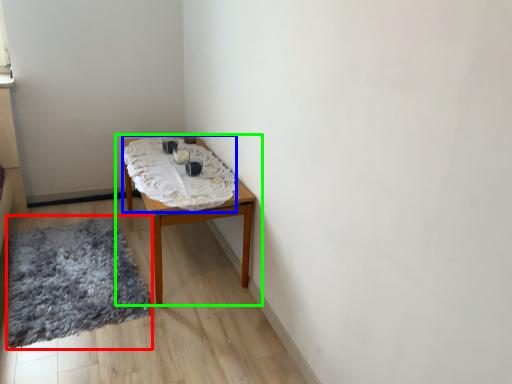
Question: Estimate the real-world distances between objects in this image. Which object is farther from mat (highlighted by a red box), blanket (highlighted by a blue box) or table (highlighted by a green box)?

Choices:
 (A) blanket
 (B) table

Answer: (A)